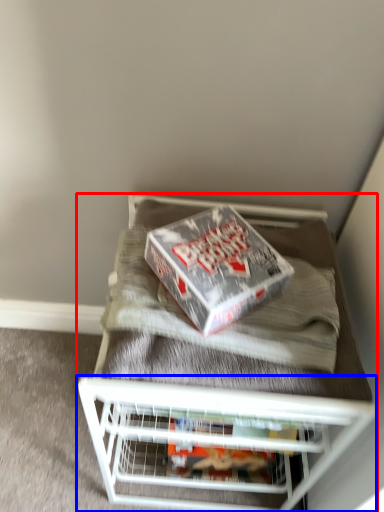
Question: Which of the following is the closest to the observer, furniture (highlighted by a red box) or shelf (highlighted by a blue box)?

Choices:
 (A) furniture
 (B) shelf

Answer: (A)